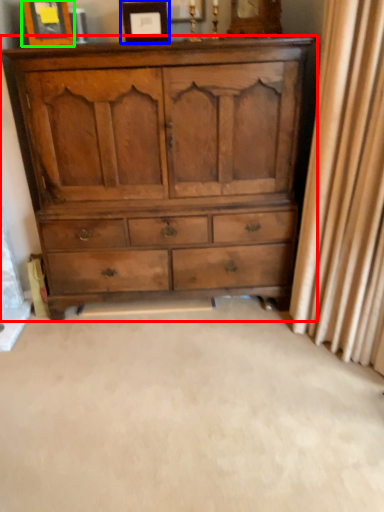
Question: Based on their relative distances, which object is farther from chest of drawers (highlighted by a red box)? Choose from picture frame (highlighted by a blue box) and picture frame (highlighted by a green box).

Choices:
 (A) picture frame
 (B) picture frame

Answer: (B)